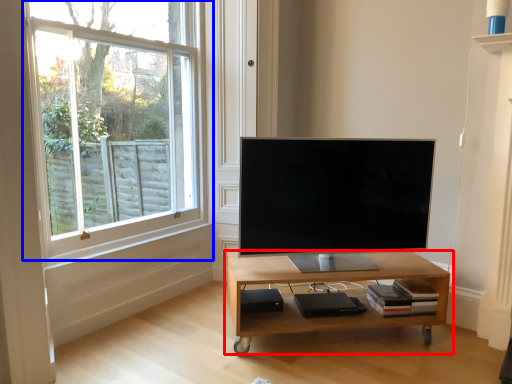
Question: Which of the following is the farthest to the observer, table (highlighted by a red box) or window (highlighted by a blue box)?

Choices:
 (A) table
 (B) window

Answer: (A)